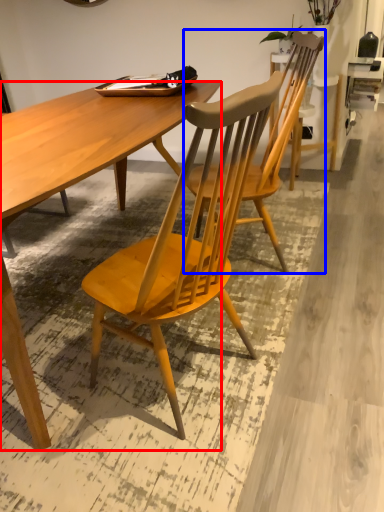
Question: Which of the following is the farthest to the observer, desk (highlighted by a red box) or chair (highlighted by a blue box)?

Choices:
 (A) desk
 (B) chair

Answer: (B)